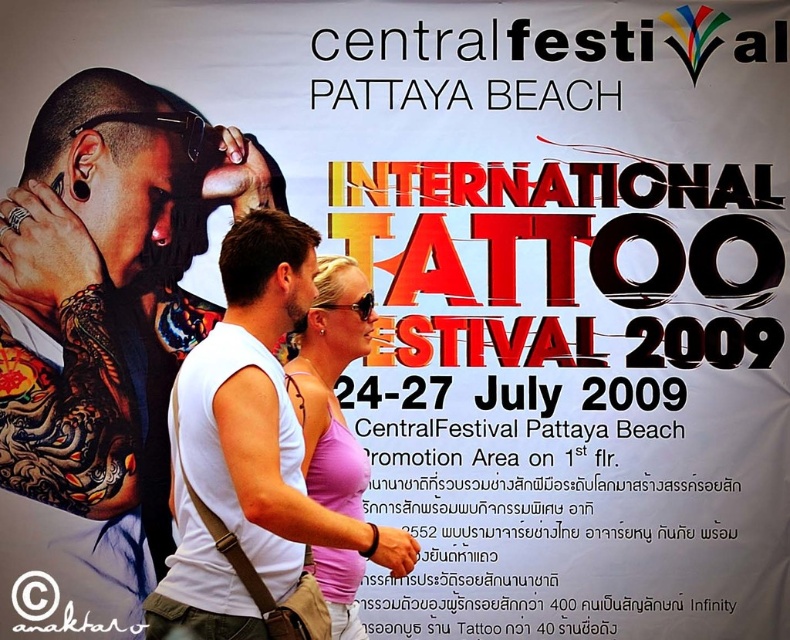
You are a photographer standing at the edge of the beach, trying to capture both the white matte tank top at center and the pink fabric tank top at center in a single shot. Given that your camera has a maximum focal length that can cover 10 meters, will you be able to include both items in your photo?

The distance between the white matte tank top at center and the pink fabric tank top at center is 9.99 meters. Since your camera can cover up to 10 meters, you can include both items in your photo as the distance is just under the maximum range.

You are designing a poster for the International Tattoo Festival 2009 and need to arrange two tank tops in the center. The white matte tank top at center and the pink fabric tank top at center must be placed according to their positions. Which tank top should be placed to the left?

The white matte tank top at center should be placed to the left of the pink fabric tank top at center because the white matte tank top at center is positioned on the left side of pink fabric tank top at center.